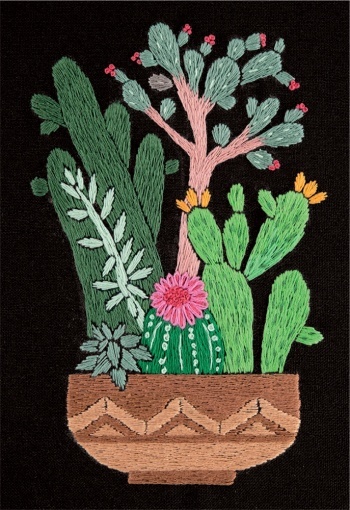
Identify the location of top of brown pot. (180, 389).